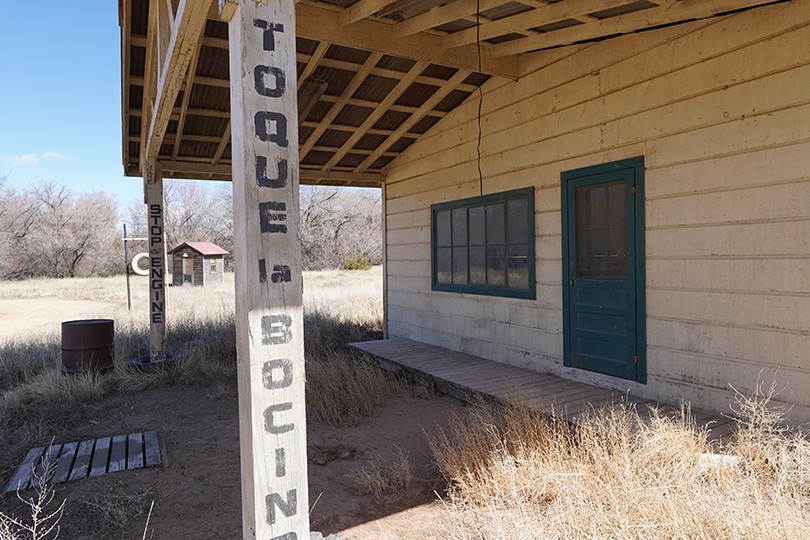
This screenshot has width=810, height=540. In order to click on dark green door-frame in this screenshot , I will do `click(563, 246)`.